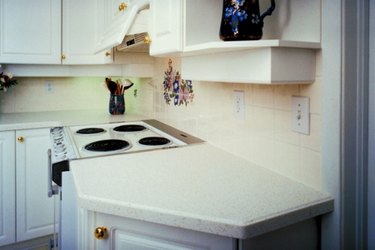
This screenshot has width=375, height=250. What are the coordinates of `outlet` in the screenshot? It's located at (239, 106).